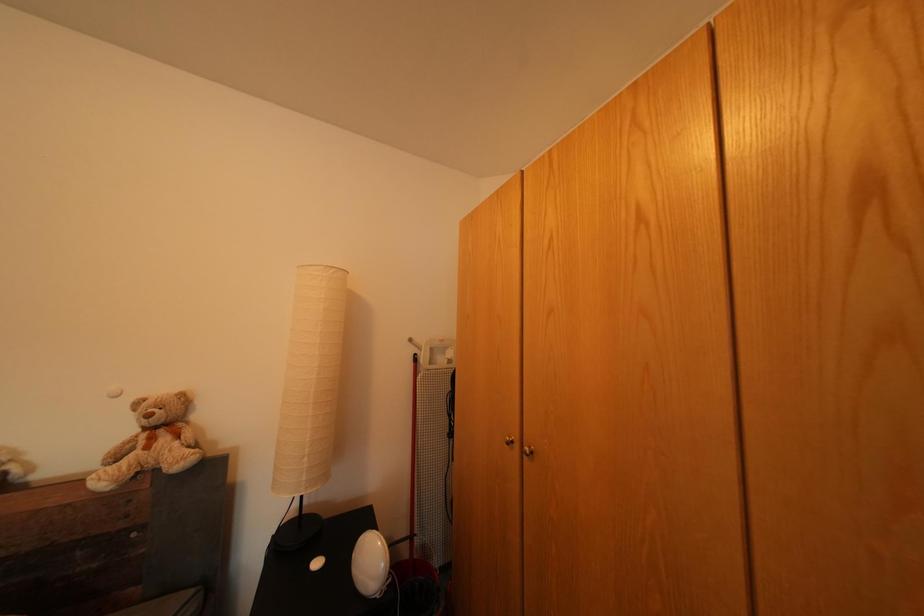
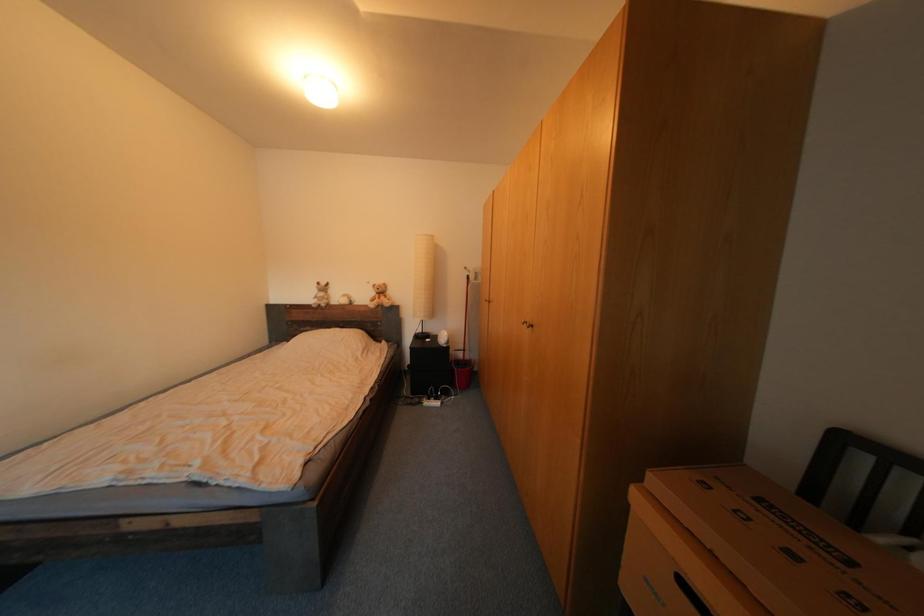
The images are taken continuously from a first-person perspective. In which direction are you moving?

The cameraman moved toward right, backward.